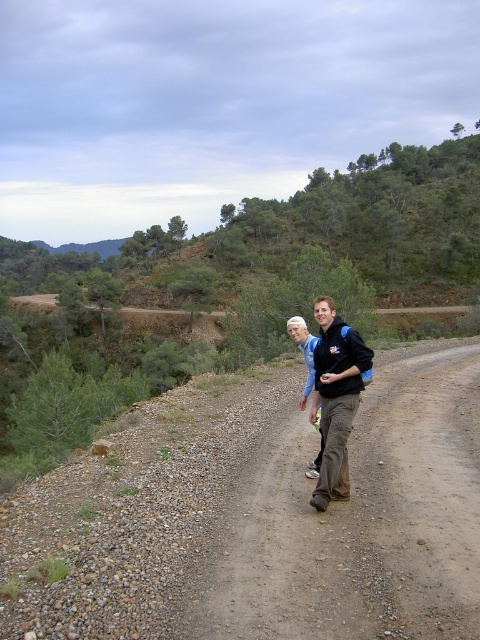
Does black softshell jacket at center have a greater height compared to dark blue jacket at center?

No, black softshell jacket at center is not taller than dark blue jacket at center.

Is black softshell jacket at center thinner than dark blue jacket at center?

Indeed, black softshell jacket at center has a lesser width compared to dark blue jacket at center.

Who is more forward, (314, 349) or (295, 324)?

Point (314, 349) is in front.

Where is `black softshell jacket at center`? The height and width of the screenshot is (640, 480). black softshell jacket at center is located at coordinates (336, 396).

Who is more distant from viewer, (444, 388) or (320, 337)?

The point (444, 388) is behind.

Measure the distance between point (439,378) and camera.

45.26 feet

Find the location of a particular element. The height and width of the screenshot is (640, 480). brown dirt trail at center is located at coordinates (361, 518).

Does brown dirt trail at center come in front of dark blue jacket at center?

Yes, it is in front of dark blue jacket at center.

Which is behind, point (348, 440) or point (312, 337)?

The point (348, 440) is behind.

You are a GUI agent. You are given a task and a screenshot of the screen. Output one action in this format:
    pyautogui.click(x=<x>, y=<y>)
    Task: Click on the brown dirt trail at center
    
    Given the screenshot: What is the action you would take?
    pyautogui.click(x=361, y=518)